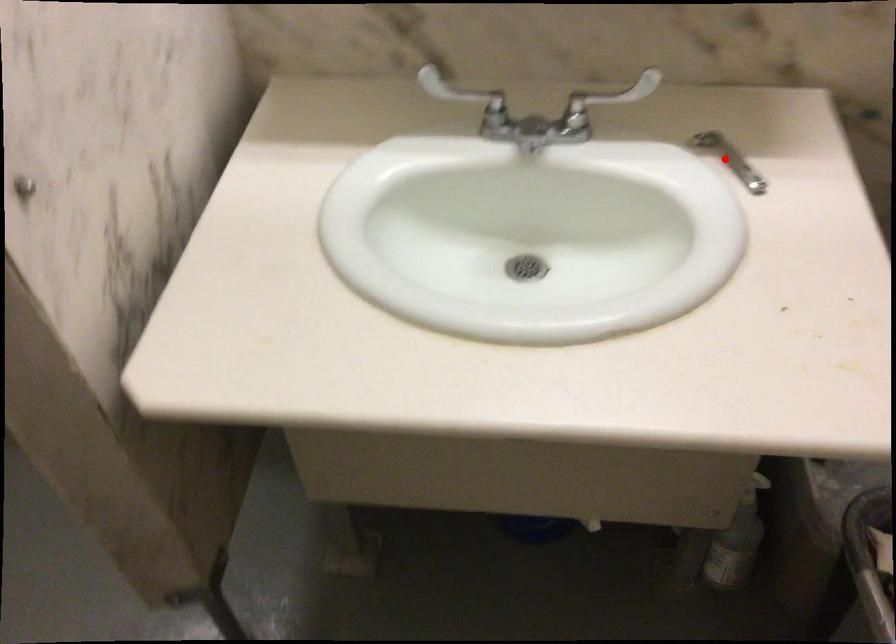
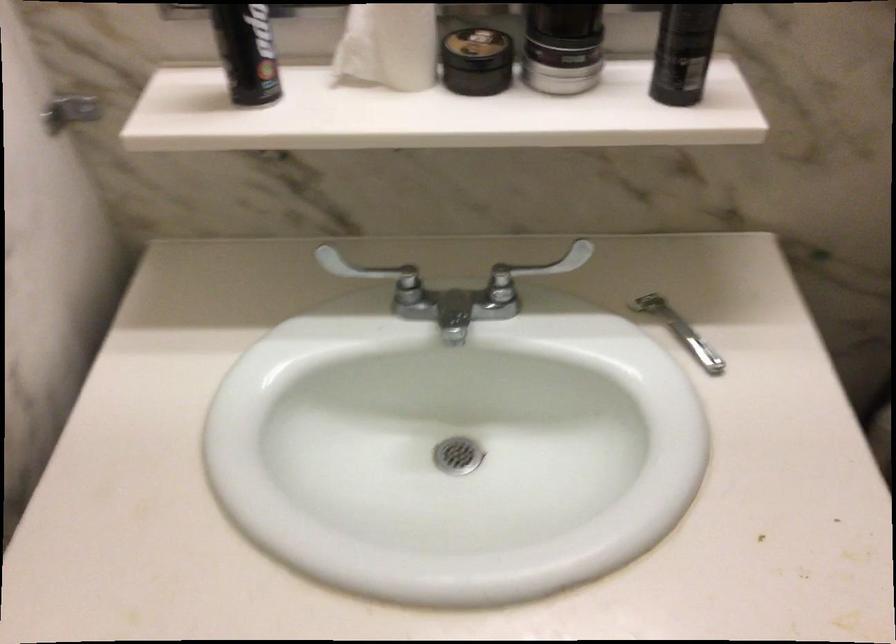
Question: I am providing you with two images of the same scene from different viewpoints. In image1, a red point is highlighted. Considering the same 3D point in image2, which of the following is correct?

Choices:
 (A) It is closer
 (B) It is farther

Answer: (A)